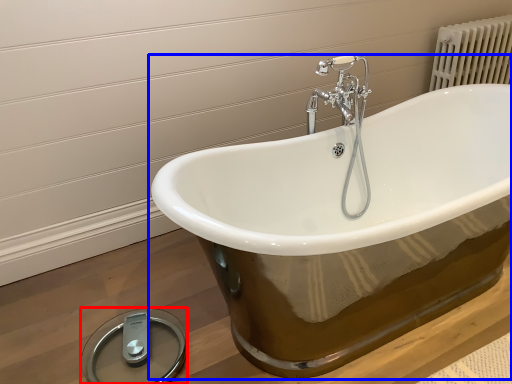
Question: Which point is closer to the camera, scale (highlighted by a red box) or bathtub (highlighted by a blue box)?

Choices:
 (A) scale
 (B) bathtub

Answer: (B)